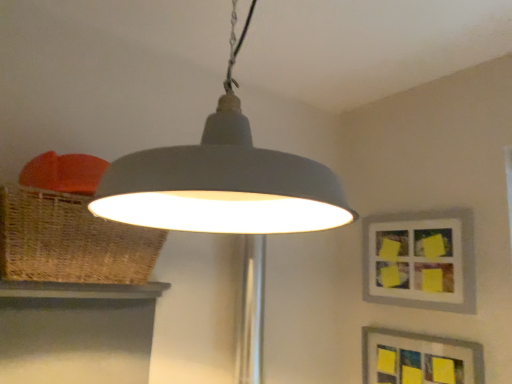
Question: Is matte gray picture frame at upper right, the 1th picture frame viewed from the top, wider than matte gray picture frame at lower right, the 1th picture frame positioned from the bottom?

Choices:
 (A) yes
 (B) no

Answer: (A)

Question: Is matte gray picture frame at upper right, the 1th picture frame viewed from the top, with matte gray picture frame at lower right, which is counted as the second picture frame, starting from the top?

Choices:
 (A) yes
 (B) no

Answer: (B)

Question: Is matte gray picture frame at upper right, the 1th picture frame viewed from the top, turned away from matte gray picture frame at lower right, the 1th picture frame positioned from the bottom?

Choices:
 (A) yes
 (B) no

Answer: (B)

Question: Does matte gray picture frame at upper right, marked as the 2th picture frame in a bottom-to-top arrangement, come behind matte gray picture frame at lower right, which is counted as the second picture frame, starting from the top?

Choices:
 (A) no
 (B) yes

Answer: (B)

Question: Does matte gray picture frame at upper right, the 1th picture frame viewed from the top, appear on the left side of matte gray picture frame at lower right, the 1th picture frame positioned from the bottom?

Choices:
 (A) yes
 (B) no

Answer: (B)

Question: From the image's perspective, is matte gray picture frame at lower right, which is counted as the second picture frame, starting from the top, located above or below matte gray picture frame at upper right, marked as the 2th picture frame in a bottom-to-top arrangement?

Choices:
 (A) above
 (B) below

Answer: (B)

Question: From a real-world perspective, is matte gray picture frame at lower right, the 1th picture frame positioned from the bottom, above or below matte gray picture frame at upper right, the 1th picture frame viewed from the top?

Choices:
 (A) above
 (B) below

Answer: (B)

Question: Considering the positions of matte gray picture frame at lower right, which is counted as the second picture frame, starting from the top, and matte gray picture frame at upper right, the 1th picture frame viewed from the top, in the image, is matte gray picture frame at lower right, which is counted as the second picture frame, starting from the top, wider or thinner than matte gray picture frame at upper right, the 1th picture frame viewed from the top,?

Choices:
 (A) wide
 (B) thin

Answer: (B)

Question: Is matte gray picture frame at lower right, the 1th picture frame positioned from the bottom, bigger or smaller than matte gray picture frame at upper right, the 1th picture frame viewed from the top?

Choices:
 (A) small
 (B) big

Answer: (A)

Question: Is point (416, 301) positioned closer to the camera than point (164, 226)?

Choices:
 (A) farther
 (B) closer

Answer: (A)

Question: In terms of size, does matte gray picture frame at upper right, the 1th picture frame viewed from the top, appear bigger or smaller than matte gray lampshade at center?

Choices:
 (A) big
 (B) small

Answer: (B)

Question: Is matte gray picture frame at upper right, the 1th picture frame viewed from the top, to the left or to the right of matte gray lampshade at center in the image?

Choices:
 (A) right
 (B) left

Answer: (A)

Question: Is matte gray picture frame at upper right, marked as the 2th picture frame in a bottom-to-top arrangement, taller or shorter than matte gray lampshade at center?

Choices:
 (A) short
 (B) tall

Answer: (A)

Question: From the image's perspective, relative to matte gray picture frame at lower right, the 1th picture frame positioned from the bottom, is matte gray picture frame at upper right, the 1th picture frame viewed from the top, above or below?

Choices:
 (A) below
 (B) above

Answer: (B)

Question: Looking at their shapes, would you say matte gray picture frame at upper right, marked as the 2th picture frame in a bottom-to-top arrangement, is wider or thinner than matte gray picture frame at lower right, which is counted as the second picture frame, starting from the top?

Choices:
 (A) thin
 (B) wide

Answer: (B)